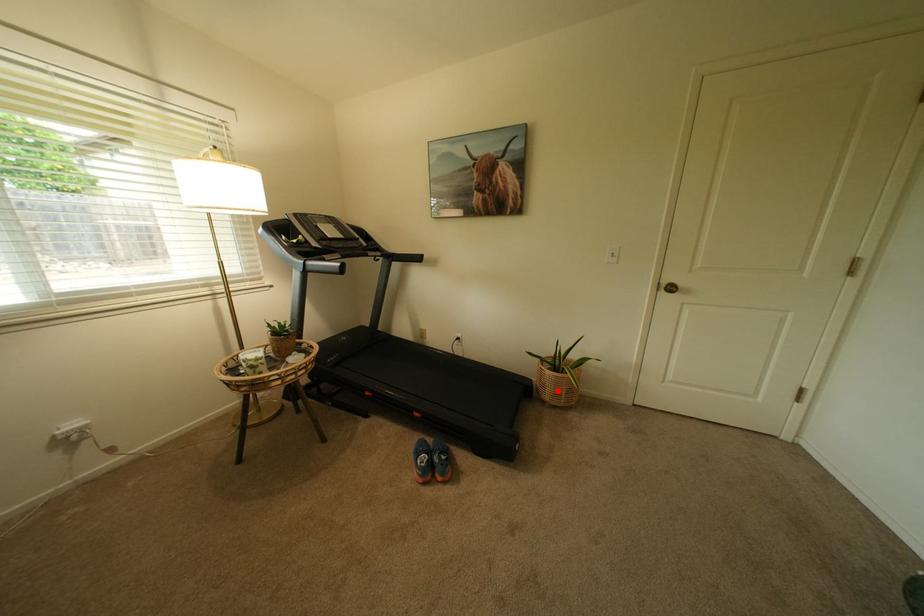
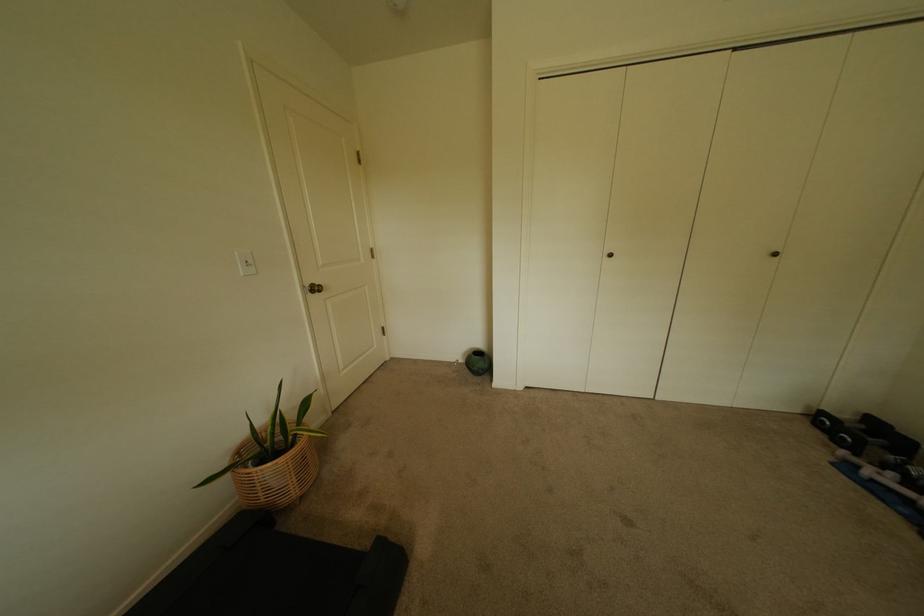
Where in the second image is the point corresponding to the highlighted location from the first image?

(302, 480)